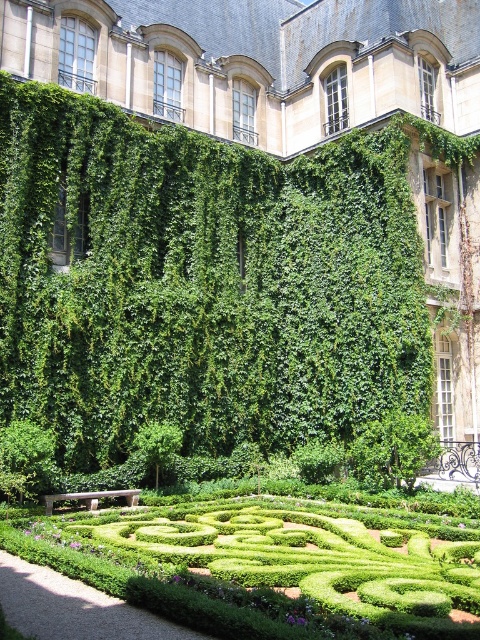
Question: Does green hedge maze at center appear under green leafy bush at center?

Choices:
 (A) no
 (B) yes

Answer: (B)

Question: Is green hedge maze at center below green leafy bush at center?

Choices:
 (A) yes
 (B) no

Answer: (A)

Question: Does green hedge maze at center have a smaller size compared to green leafy bush at center?

Choices:
 (A) no
 (B) yes

Answer: (A)

Question: Which object appears farthest from the camera in this image?

Choices:
 (A) green leafy bush at center
 (B) green hedge maze at center

Answer: (A)

Question: Which object is farther from the camera taking this photo?

Choices:
 (A) green leafy bush at center
 (B) green hedge maze at center

Answer: (A)